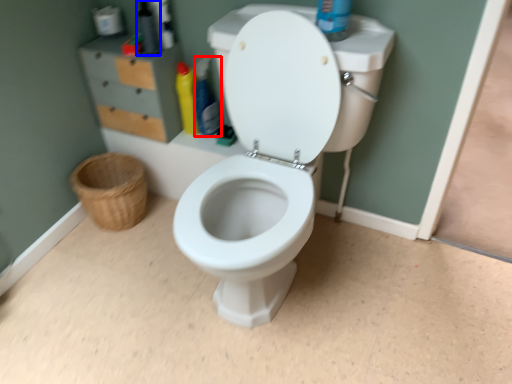
Question: Which point is further to the camera, cleaning product (highlighted by a red box) or toiletry (highlighted by a blue box)?

Choices:
 (A) cleaning product
 (B) toiletry

Answer: (A)